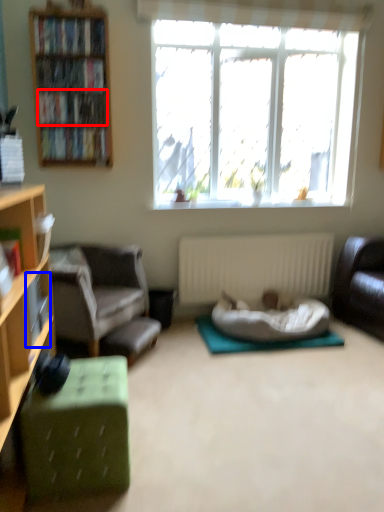
Question: Which of the following is the closest to the observer, book (highlighted by a red box) or book (highlighted by a blue box)?

Choices:
 (A) book
 (B) book

Answer: (B)